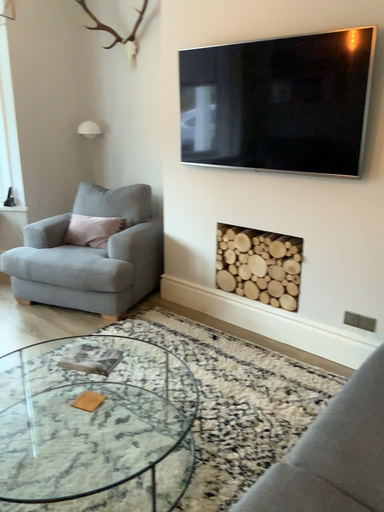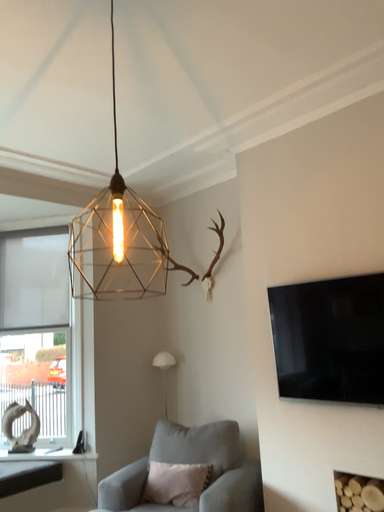
Question: Which way did the camera rotate in the video?

Choices:
 (A) rotated downward
 (B) rotated upward

Answer: (B)